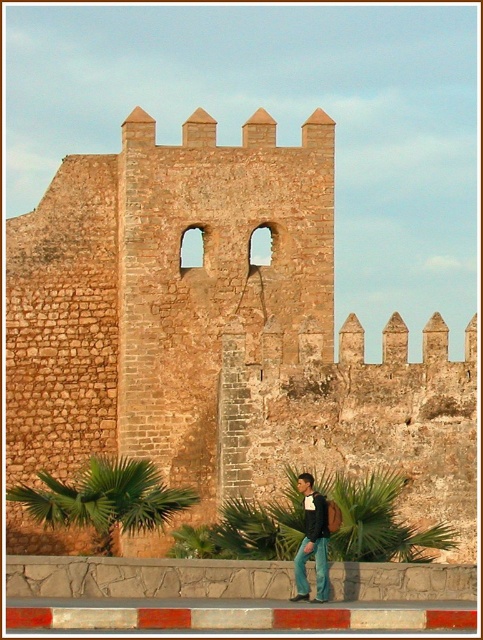
Is brown stone wall at center wider than green leafy palm at lower left?

Yes.

What do you see at coordinates (218, 330) in the screenshot?
I see `brown stone wall at center` at bounding box center [218, 330].

At what (x,y) coordinates should I click in order to perform the action: click on brown stone wall at center. Please return your answer as a coordinate pair (x, y). Image resolution: width=483 pixels, height=640 pixels. Looking at the image, I should click on (218, 330).

Is point (302, 577) positioned after point (306, 586)?

Yes, point (302, 577) is farther from viewer.

Is jeans at lower right taller than jeans at lower center?

No.

This screenshot has width=483, height=640. Find the location of `jeans at lower right`. jeans at lower right is located at coordinates (312, 541).

Is brown stone wall at center to the left of jeans at lower right from the viewer's perspective?

Yes, brown stone wall at center is to the left of jeans at lower right.

How distant is brown stone wall at center from jeans at lower right?

84.39 feet

Which is behind, point (466, 476) or point (312, 508)?

The point (466, 476) is more distant.

Locate an element on the screen. This screenshot has width=483, height=640. brown stone wall at center is located at coordinates (218, 330).